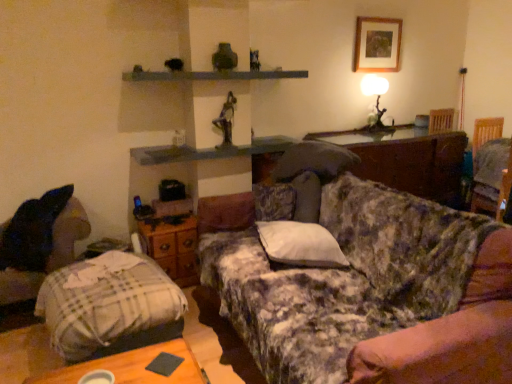
The height and width of the screenshot is (384, 512). What are the coordinates of `matte white wood table lamp at upper right` in the screenshot? It's located at (376, 99).

What do you see at coordinates (492, 162) in the screenshot? I see `fluffy white pillow at right, acting as the second pillow starting from the left` at bounding box center [492, 162].

Where is `metallic gray shelf at upper center`? metallic gray shelf at upper center is located at coordinates (213, 75).

Describe the element at coordinates (355, 282) in the screenshot. I see `floral fabric couch at center` at that location.

The width and height of the screenshot is (512, 384). Describe the element at coordinates (106, 302) in the screenshot. I see `plaid fabric bedcover at lower left` at that location.

What do you see at coordinates (172, 247) in the screenshot? This screenshot has height=384, width=512. I see `wooden drawer at center` at bounding box center [172, 247].

Identify the location of wooden drawer at center. (172, 247).

The image size is (512, 384). I want to click on matte white wood table lamp at upper right, so click(376, 99).

Does point (441, 380) appear closer or farther from the camera than point (169, 228)?

Clearly, point (441, 380) is closer to the camera than point (169, 228).

Between floral fabric couch at center and wooden drawer at center, which one has smaller size?

wooden drawer at center is smaller.

Considering their positions, is floral fabric couch at center located in front of or behind wooden drawer at center?

floral fabric couch at center is in front of wooden drawer at center.

Which object is closer to the camera, wooden table at center or wooden drawer at center?

Positioned in front is wooden drawer at center.

Is wooden table at center far from wooden drawer at center?

wooden table at center is positioned a significant distance from wooden drawer at center.

Is wooden table at center taller than wooden drawer at center?

Indeed, wooden table at center has a greater height compared to wooden drawer at center.

How much distance is there between matte white wood table lamp at upper right and plaid fabric bedcover at lower left?

matte white wood table lamp at upper right is 2.70 meters from plaid fabric bedcover at lower left.

Does point (385, 81) appear closer or farther from the camera than point (132, 310)?

Point (385, 81) is farther from the camera than point (132, 310).

Is matte white wood table lamp at upper right aimed at plaid fabric bedcover at lower left?

No, matte white wood table lamp at upper right is not facing towards plaid fabric bedcover at lower left.

Looking at this image, is matte white wood table lamp at upper right bigger than plaid fabric bedcover at lower left?

No, matte white wood table lamp at upper right is not bigger than plaid fabric bedcover at lower left.

How different are the orientations of metallic gray shelf at upper center and dark fabric swivel chair at lower left, which appears as the 1th swivel chair when viewed from the front, in degrees?

The angular difference between metallic gray shelf at upper center and dark fabric swivel chair at lower left, which appears as the 1th swivel chair when viewed from the front, is 0.746 degrees.

Which object is wider, metallic gray shelf at upper center or dark fabric swivel chair at lower left, which appears as the 1th swivel chair when viewed from the front?

With larger width is dark fabric swivel chair at lower left, which appears as the 1th swivel chair when viewed from the front.

Identify the location of the 2nd swivel chair positioned below the metallic gray shelf at upper center (from the image's perspective). (69, 233).

Who is more distant, matte white wood table lamp at upper right or wooden table at center?

matte white wood table lamp at upper right.

This screenshot has width=512, height=384. Identify the location of table lamp above the wooden table at center (from the image's perspective). (376, 99).

Which object is wider, matte white wood table lamp at upper right or wooden table at center?

With larger width is wooden table at center.

How many degrees apart are the facing directions of matte white wood table lamp at upper right and wooden table at center?

The facing directions of matte white wood table lamp at upper right and wooden table at center are 0.272 degrees apart.

Looking at their sizes, would you say white soft pillow at center, the 1th pillow in the front-to-back sequence, is wider or thinner than matte white wood table lamp at upper right?

In the image, white soft pillow at center, the 1th pillow in the front-to-back sequence, appears to be wider than matte white wood table lamp at upper right.

Locate an element on the screen. This screenshot has width=512, height=384. table lamp above the white soft pillow at center, acting as the 2th pillow starting from the back (from the image's perspective) is located at coordinates (376, 99).

Between point (290, 245) and point (371, 76), which one is positioned in front?

The point (290, 245) is in front.

From a real-world perspective, which object stands above the other?

In real-world perspective, matte white wood table lamp at upper right is above.

Is dark fabric swivel chair at lower left, the 2th swivel chair when ordered from back to front, facing towards fluffy white pillow at right, positioned as the second pillow in front-to-back order?

No, dark fabric swivel chair at lower left, the 2th swivel chair when ordered from back to front, is not oriented towards fluffy white pillow at right, positioned as the second pillow in front-to-back order.

Which point is more distant from viewer, (81, 228) or (490, 165)?

The point (490, 165) is more distant.

Can you confirm if dark fabric swivel chair at lower left, which appears as the second swivel chair when viewed from the right, is smaller than fluffy white pillow at right, positioned as the second pillow in front-to-back order?

No, dark fabric swivel chair at lower left, which appears as the second swivel chair when viewed from the right, is not smaller than fluffy white pillow at right, positioned as the second pillow in front-to-back order.

This screenshot has width=512, height=384. What are the coordinates of `drawer behind the floral fabric couch at center` in the screenshot? It's located at point(172,247).

Image resolution: width=512 pixels, height=384 pixels. I want to click on table on the right of wooden drawer at center, so (416, 164).

Estimate the real-world distances between objects in this image. Which object is further from wooden table at center, plaid fabric bedcover at lower left or fluffy white pillow at right, positioned as the second pillow in front-to-back order?

plaid fabric bedcover at lower left is positioned further to the anchor wooden table at center.

Which object lies further to the anchor point wooden picture frame at upper right, floral fabric couch at center or white soft pillow at center, marked as the first pillow in a bottom-to-top arrangement?

The object further to wooden picture frame at upper right is floral fabric couch at center.

Consider the image. Considering their positions, is wooden picture frame at upper right positioned further to white soft pillow at center, arranged as the second pillow when viewed from the right, than wooden drawer at center?

wooden picture frame at upper right is positioned further to the anchor white soft pillow at center, arranged as the second pillow when viewed from the right.

Considering their positions, is wooden drawer at center positioned closer to wooden table at center than plaid fabric bedcover at lower left?

wooden drawer at center lies closer to wooden table at center than the other object.

When comparing their distances from plaid fabric bedcover at lower left, does white soft pillow at center, which ranks as the 2th pillow in top-to-bottom order, or dark fabric swivel chair at lower left, the second swivel chair when ordered from top to bottom, seem further?

The object further to plaid fabric bedcover at lower left is white soft pillow at center, which ranks as the 2th pillow in top-to-bottom order.

Which object lies nearer to the anchor point wooden picture frame at upper right, matte white wood table lamp at upper right or plaid fabric bedcover at lower left?

matte white wood table lamp at upper right lies closer to wooden picture frame at upper right than the other object.

From the image, which object appears to be farther from fluffy white pillow at right, positioned as the second pillow in front-to-back order, white soft pillow at center, acting as the 1th pillow starting from the left, or floral fabric couch at center?

floral fabric couch at center is positioned further to the anchor fluffy white pillow at right, positioned as the second pillow in front-to-back order.

Based on their spatial positions, is metallic gray shelf at upper center or wooden table at center further from dark fabric swivel chair at lower left, the 2th swivel chair when ordered from back to front?

The object further to dark fabric swivel chair at lower left, the 2th swivel chair when ordered from back to front, is wooden table at center.

Identify the location of pillow between plaid fabric bedcover at lower left and fluffy white pillow at right, the first pillow from the right, from left to right. (300, 244).

Find the location of a particular element. This screenshot has width=512, height=384. studio couch between plaid fabric bedcover at lower left and dark wood swivel chair at right, acting as the second swivel chair starting from the front, from left to right is located at coordinates (355, 282).

The height and width of the screenshot is (384, 512). In order to click on drawer between metallic gray shelf at upper center and dark fabric swivel chair at lower left, the second swivel chair when ordered from top to bottom, in the up-down direction in this screenshot , I will do `click(172, 247)`.

Locate an element on the screen. table located between matte white wood table lamp at upper right and dark wood swivel chair at right, which is counted as the 1th swivel chair, starting from the right, in the left-right direction is located at coordinates (416, 164).